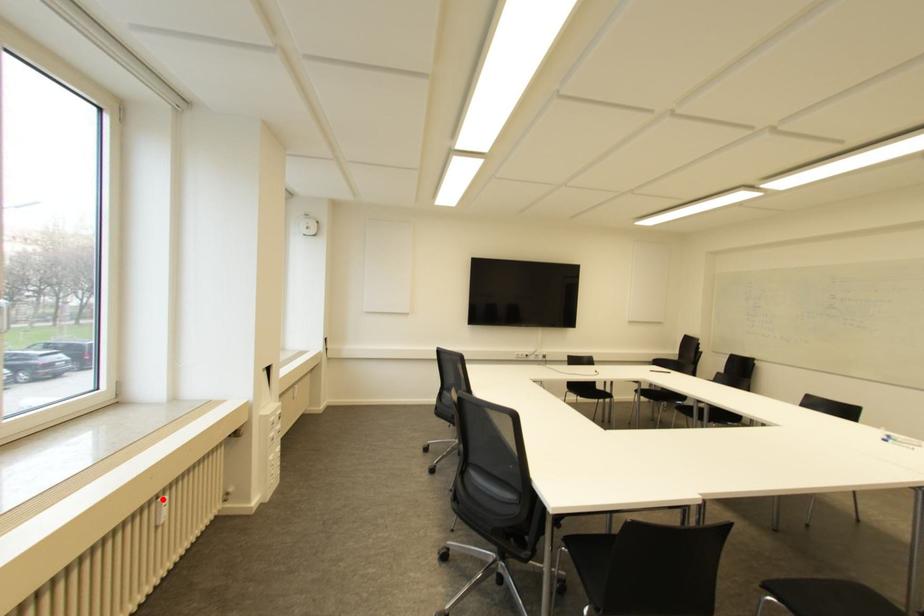
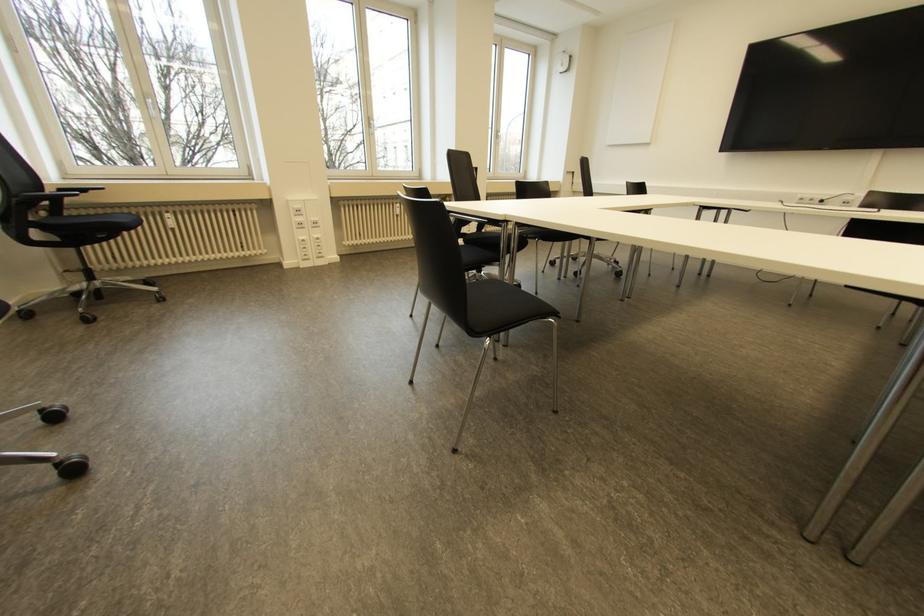
Question: I am providing you with two images of the same scene from different viewpoints. A red point is shown in image1. For the corresponding object point in image2, is it positioned nearer or farther from the camera?

Choices:
 (A) Nearer
 (B) Farther

Answer: (A)